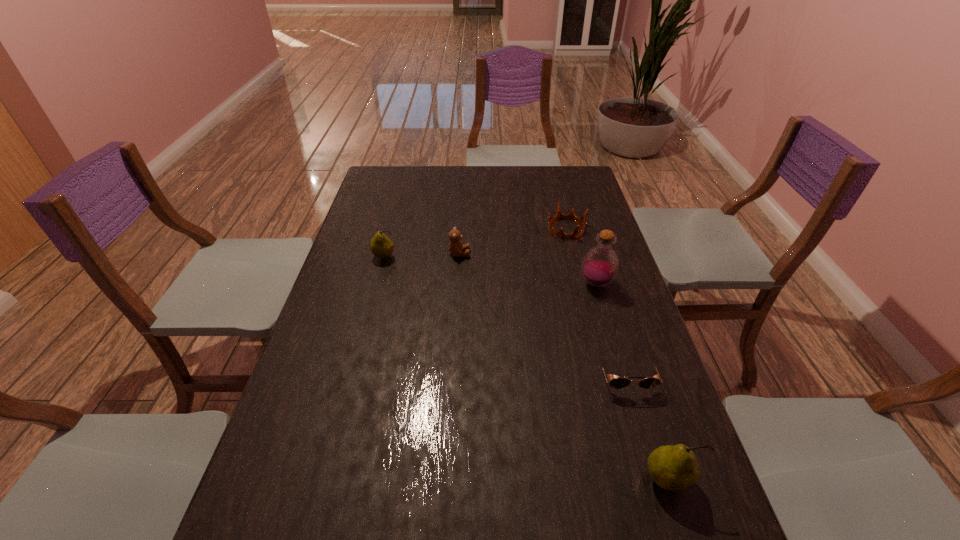
The image size is (960, 540). What are the coordinates of `the left pear` in the screenshot? It's located at (381, 246).

Where is `the fourth shortest object`? the fourth shortest object is located at coordinates (381, 246).

Find the location of `the second tallest object`. the second tallest object is located at coordinates (672, 468).

Locate an element on the screen. This screenshot has height=540, width=960. the nearest object is located at coordinates (672, 468).

This screenshot has width=960, height=540. Find the location of `the farthest object`. the farthest object is located at coordinates (559, 215).

Find the location of a particular element. the fifth farthest object is located at coordinates (617, 383).

Find the location of `the fourth farthest object`. the fourth farthest object is located at coordinates (600, 265).

You are a GUI agent. You are given a task and a screenshot of the screen. Output one action in this format:
    pyautogui.click(x=<x>, y=<y>)
    Task: Click on the tallest object
    This screenshot has width=960, height=540.
    Given the screenshot: What is the action you would take?
    pyautogui.click(x=600, y=265)

Image resolution: width=960 pixels, height=540 pixels. Identify the location of the second object from left to right. (456, 247).

Locate an element on the screen. This screenshot has width=960, height=540. the third shortest object is located at coordinates (456, 247).